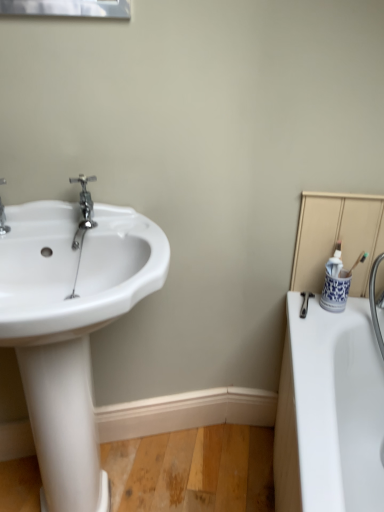
Question: Is polished chrome faucet at left spatially inside blue and white ceramic cup at right, or outside of it?

Choices:
 (A) outside
 (B) inside

Answer: (A)

Question: From the image's perspective, is polished chrome faucet at left positioned above or below blue and white ceramic cup at right?

Choices:
 (A) above
 (B) below

Answer: (A)

Question: Which is nearer to the blue and white ceramic cup at right?

Choices:
 (A) white glossy sink at left
 (B) polished chrome faucet at left

Answer: (B)

Question: Based on their relative distances, which object is nearer to the white glossy sink at left?

Choices:
 (A) polished chrome faucet at left
 (B) blue and white ceramic cup at right

Answer: (A)